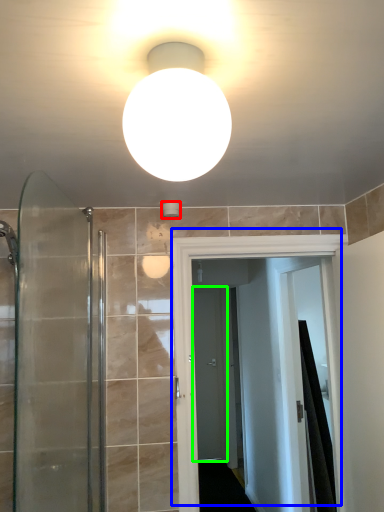
Question: Based on their relative distances, which object is nearer to fixture (highlighted by a red box)? Choose from door (highlighted by a blue box) and screen door (highlighted by a green box).

Choices:
 (A) door
 (B) screen door

Answer: (A)